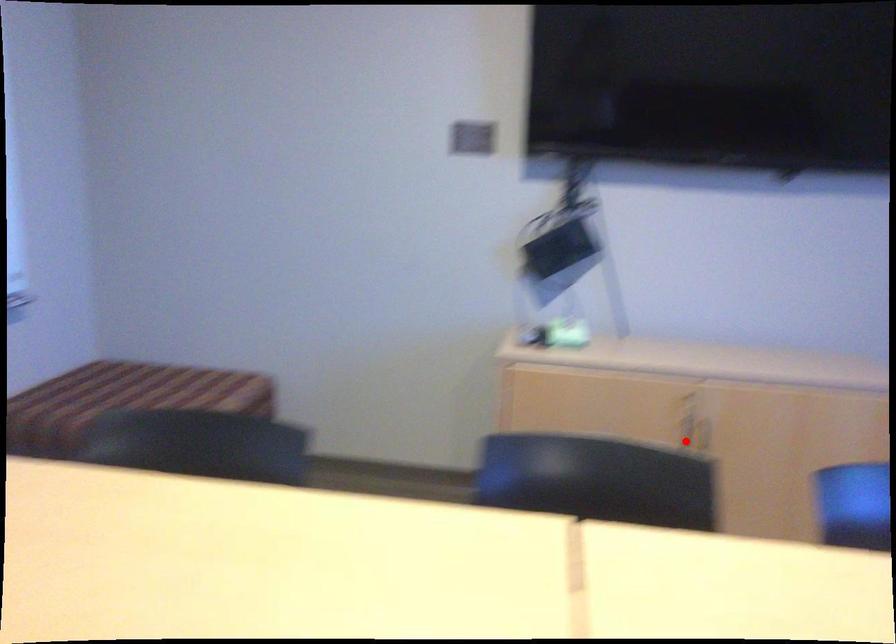
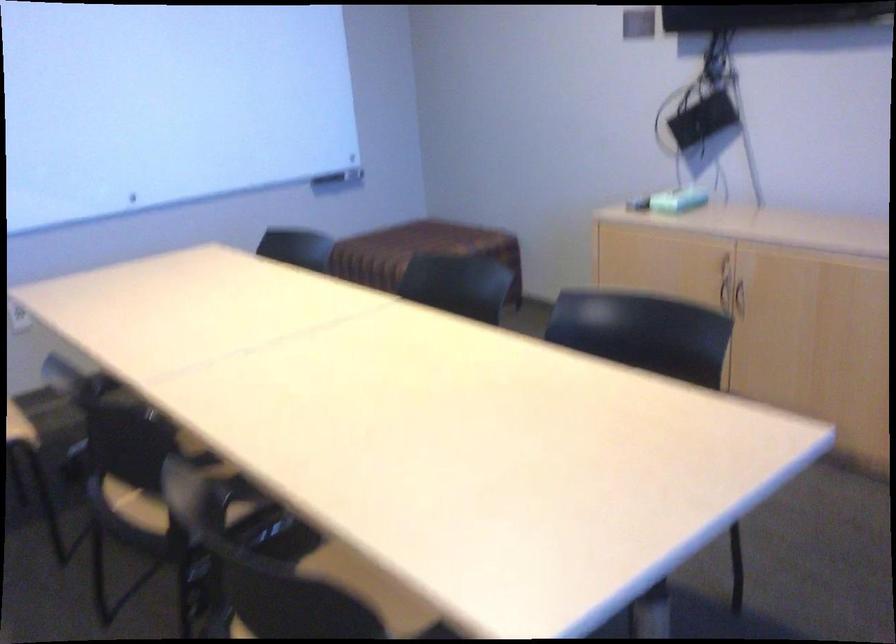
The point at the highlighted location is marked in the first image. Where is the corresponding point in the second image?

(738, 299)